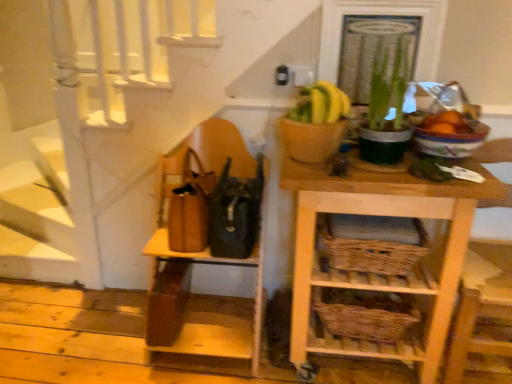
Question: Considering the relative positions of green leafy plant at upper right and wooden chair at right in the image provided, is green leafy plant at upper right to the left of wooden chair at right from the viewer's perspective?

Choices:
 (A) no
 (B) yes

Answer: (B)

Question: From a real-world perspective, is green leafy plant at upper right on wooden chair at right?

Choices:
 (A) yes
 (B) no

Answer: (A)

Question: Is green leafy plant at upper right wider than wooden chair at right?

Choices:
 (A) yes
 (B) no

Answer: (B)

Question: Can you confirm if green leafy plant at upper right is shorter than wooden chair at right?

Choices:
 (A) no
 (B) yes

Answer: (B)

Question: Can you confirm if green leafy plant at upper right is taller than wooden chair at right?

Choices:
 (A) no
 (B) yes

Answer: (A)

Question: From the image's perspective, is light wood wicker basket at center right, which ranks as the 2th shelf in left-to-right order, located above or below woven brown basket at lower center, acting as the 1th basket starting from the bottom?

Choices:
 (A) below
 (B) above

Answer: (B)

Question: Does point (450, 193) appear closer or farther from the camera than point (369, 309)?

Choices:
 (A) farther
 (B) closer

Answer: (B)

Question: Visually, is light wood wicker basket at center right, which ranks as the 2th shelf in left-to-right order, positioned to the left or to the right of woven brown basket at lower center, acting as the 1th basket starting from the bottom?

Choices:
 (A) left
 (B) right

Answer: (B)

Question: Based on their sizes in the image, would you say light wood wicker basket at center right, which ranks as the 2th shelf in left-to-right order, is bigger or smaller than woven brown basket at lower center, which is the second basket from top to bottom?

Choices:
 (A) big
 (B) small

Answer: (A)

Question: Is green leafy plant at upper right in front of or behind light wood wicker basket at center right, which ranks as the 2th shelf in left-to-right order, in the image?

Choices:
 (A) behind
 (B) front

Answer: (A)

Question: From a real-world perspective, is green leafy plant at upper right positioned above or below light wood wicker basket at center right, the 1th shelf viewed from the right?

Choices:
 (A) below
 (B) above

Answer: (B)

Question: In terms of width, does green leafy plant at upper right look wider or thinner when compared to light wood wicker basket at center right, which ranks as the 2th shelf in left-to-right order?

Choices:
 (A) wide
 (B) thin

Answer: (B)

Question: Considering the positions of green leafy plant at upper right and light wood wicker basket at center right, the 1th shelf viewed from the right, in the image, is green leafy plant at upper right taller or shorter than light wood wicker basket at center right, the 1th shelf viewed from the right,?

Choices:
 (A) tall
 (B) short

Answer: (B)

Question: Considering the positions of point (415, 289) and point (364, 216), is point (415, 289) closer or farther from the camera than point (364, 216)?

Choices:
 (A) farther
 (B) closer

Answer: (B)

Question: In terms of height, does light wood wicker basket at center right, the 1th shelf viewed from the right, look taller or shorter compared to woven brown basket at lower center, which is the first basket from top to bottom?

Choices:
 (A) short
 (B) tall

Answer: (B)